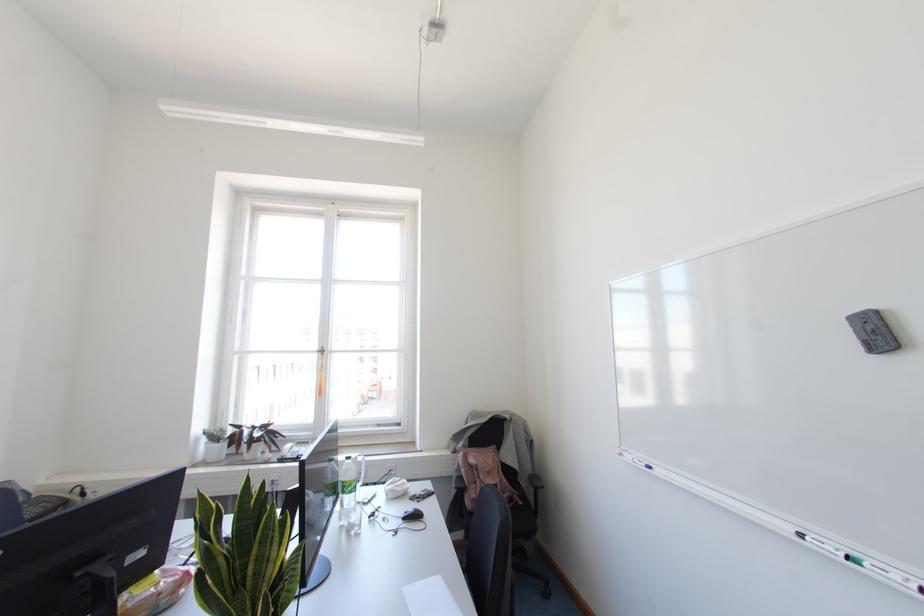
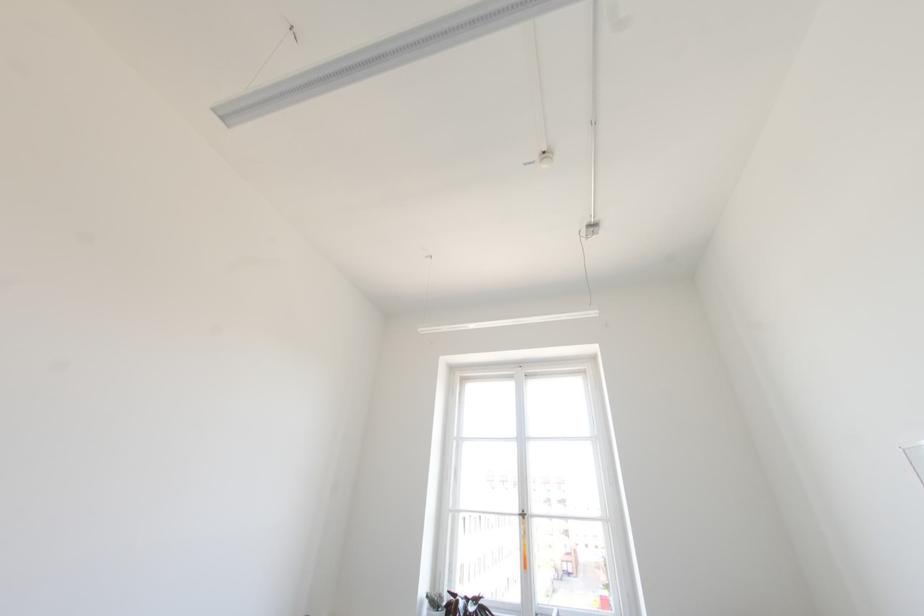
The first image is from the beginning of the video and the second image is from the end. How did the camera likely rotate when shooting the video?

The camera rotated toward left-up.